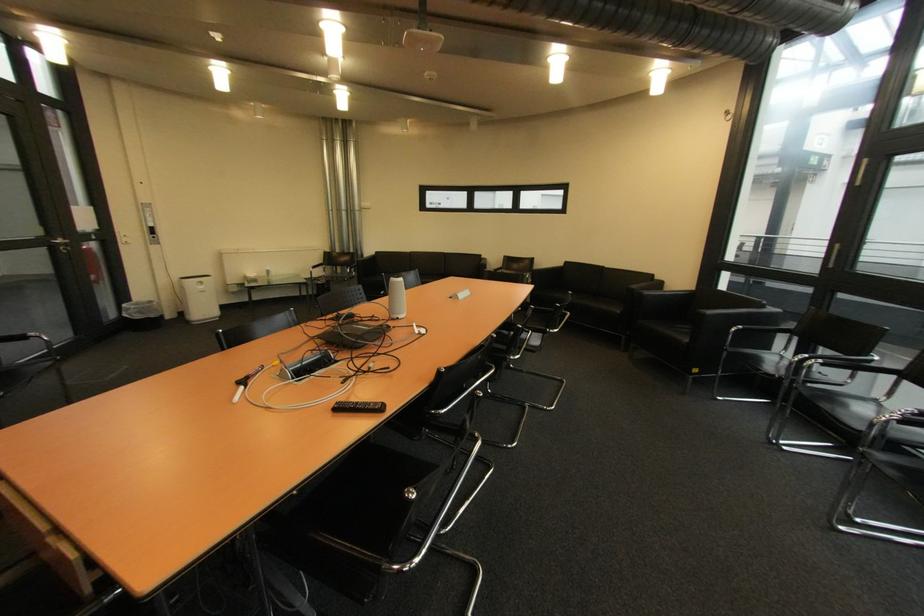
Where is `silver door handle`? This screenshot has height=616, width=924. silver door handle is located at coordinates (59, 243).